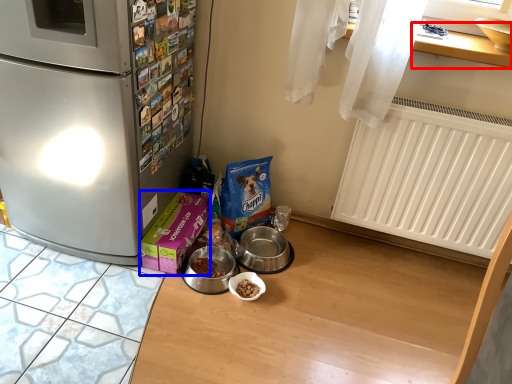
Question: Which point is further to the camera, window sill (highlighted by a red box) or box (highlighted by a blue box)?

Choices:
 (A) window sill
 (B) box

Answer: (B)